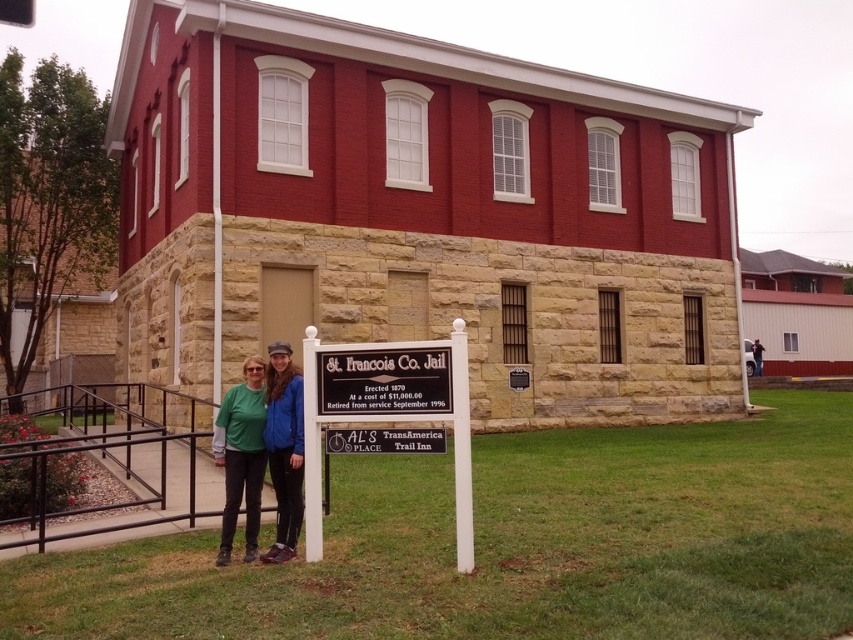
Question: Which point appears closest to the camera in this image?

Choices:
 (A) (321, 552)
 (B) (222, 458)

Answer: (A)

Question: Which is farther from the dark blue jeans at center?

Choices:
 (A) matte blue jacket at center
 (B) green fabric at center

Answer: (B)

Question: Which of the following is the farthest from the observer?

Choices:
 (A) black metal sign at center
 (B) matte blue jacket at center

Answer: (B)

Question: Does green fabric at center come behind dark blue jeans at center?

Choices:
 (A) yes
 (B) no

Answer: (B)

Question: Can you confirm if black metal sign at center is positioned below matte blue jacket at center?

Choices:
 (A) no
 (B) yes

Answer: (A)

Question: Is green fabric at center further to the viewer compared to dark blue jeans at center?

Choices:
 (A) yes
 (B) no

Answer: (B)